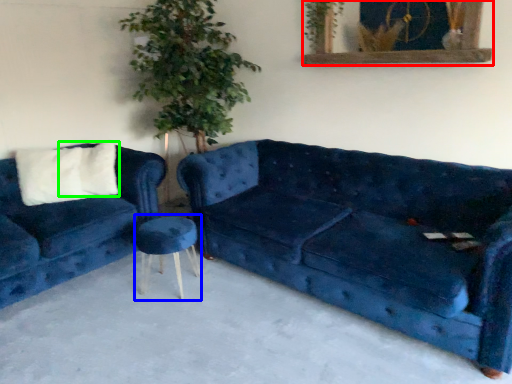
Question: Which is farther away from picture frame (highlighted by a red box)? stool (highlighted by a blue box) or pillow (highlighted by a green box)?

Choices:
 (A) stool
 (B) pillow

Answer: (B)